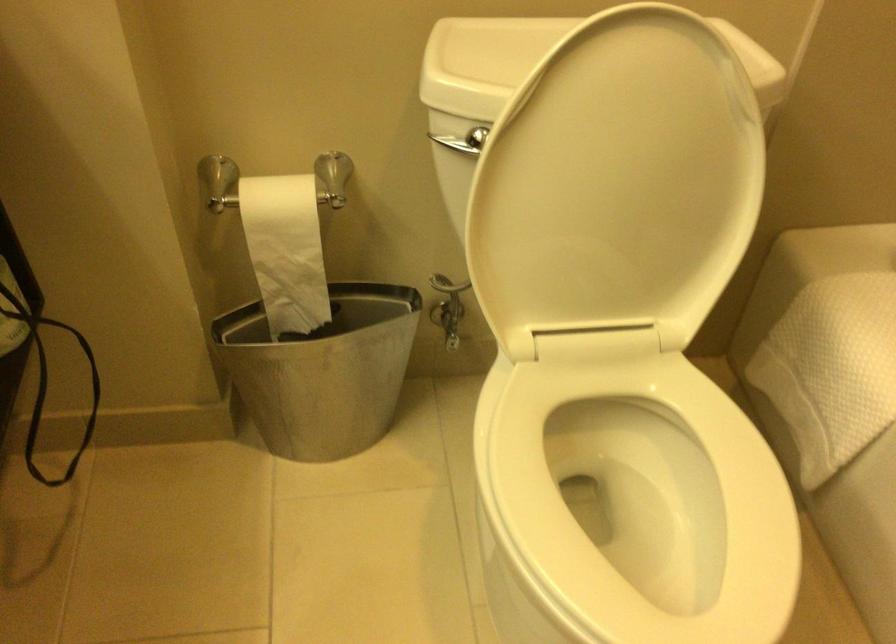
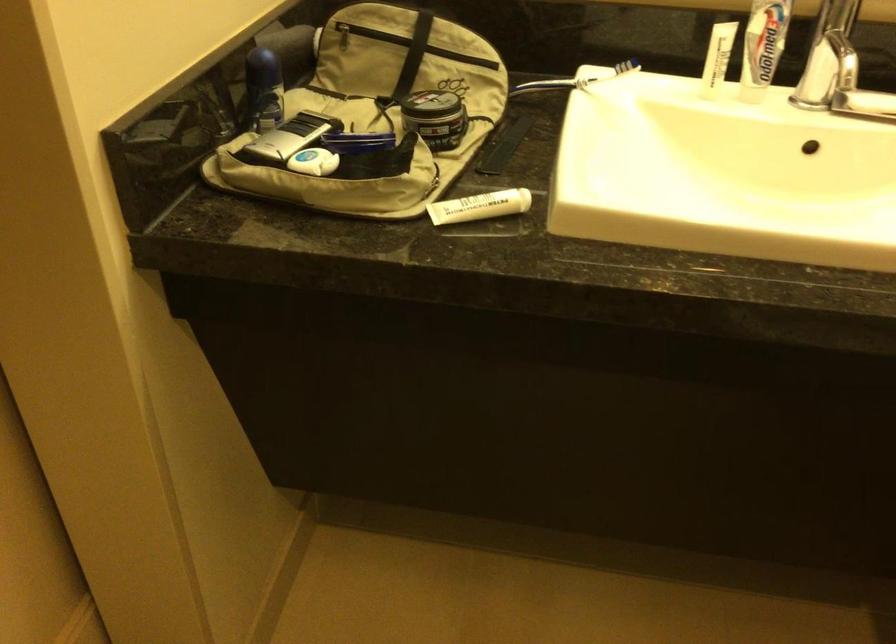
How did the camera likely rotate?

The camera's rotation is toward left-down.